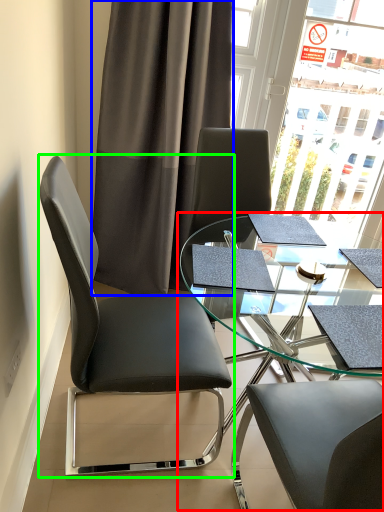
Question: Estimate the real-world distances between objects in this image. Which object is farther from table (highlighted by a red box), curtain (highlighted by a blue box) or chair (highlighted by a green box)?

Choices:
 (A) curtain
 (B) chair

Answer: (A)